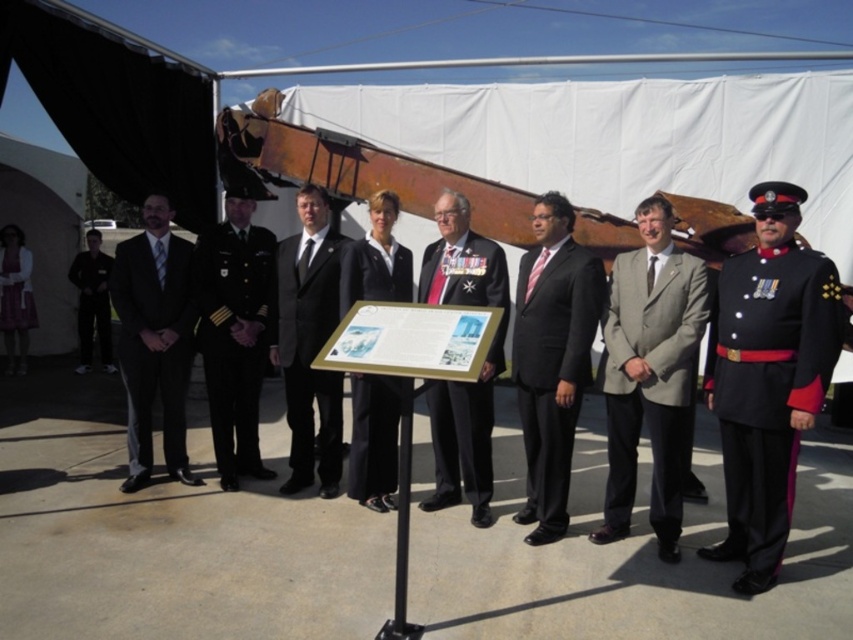
You are organizing a photo shoot for a military ceremony. The scene includes a shiny black uniform at right and a black satin tie at center. Which object should you focus on first if you want to capture the most visually prominent element in the photo?

The black satin tie at center should be focused on first because it occupies more space in the image than the shiny black uniform at right.

You are a photographer at the event and need to capture a photo of both the black satin tie at center and the black uniform at left in the same frame. Your camera has a maximum focus range of 6 meters. Will you be able to fit both objects in the frame?

The distance between the black satin tie at center and the black uniform at left is 6.03 meters, which exceeds the camera maximum focus range of 6 meters. Therefore, you cannot fit both objects in the frame.